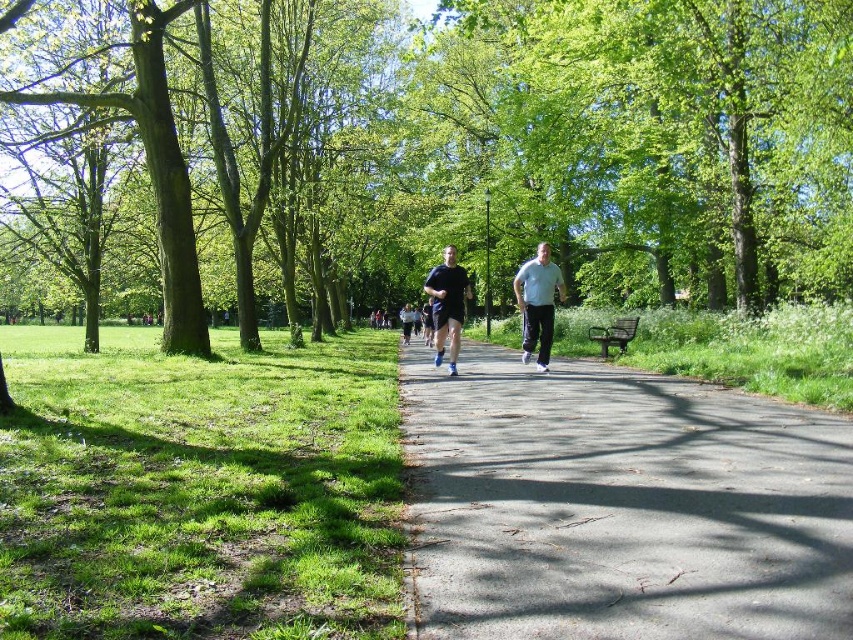
Question: Where is green leafy tree at center located in relation to asphalt path at center in the image?

Choices:
 (A) below
 (B) above

Answer: (B)

Question: Which object is closer to the camera taking this photo?

Choices:
 (A) light blue fabric shirt at center
 (B) dark blue fabric running shoe at center

Answer: (A)

Question: Based on their relative distances, which object is nearer to the light blue fabric shirt at center?

Choices:
 (A) asphalt path at center
 (B) green leafy tree at center

Answer: (A)

Question: Is light blue fabric shirt at center to the left of dark blue fabric running shoe at center from the viewer's perspective?

Choices:
 (A) yes
 (B) no

Answer: (B)

Question: Does green leafy tree at center come in front of dark blue fabric running shoe at center?

Choices:
 (A) yes
 (B) no

Answer: (A)

Question: Among these points, which one is nearest to the camera?

Choices:
 (A) (541, 356)
 (B) (735, 416)
 (C) (171, 244)

Answer: (B)